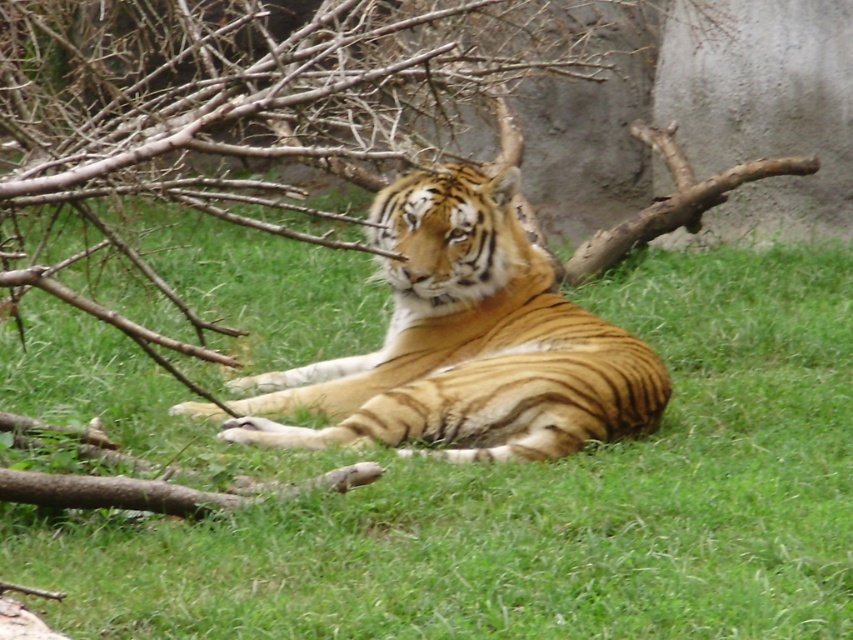
You are a visitor at the zoo, and you notice two points in the image. The first point is at location point (703, 340), and the second point is at point (509, 371). Which of these two points is closer to you?

Point (509, 371) is closer to you because it is less further to the camera than point (703, 340).